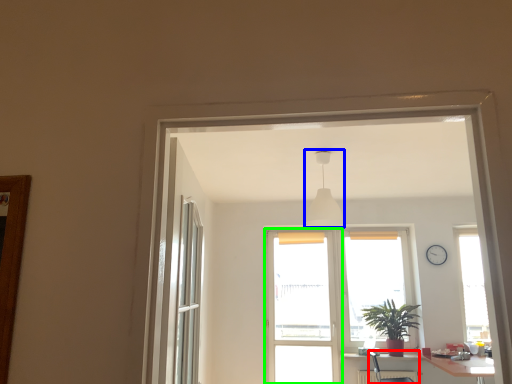
Question: Which object is positioned closest to armchair (highlighted by a red box)? Select from light fixture (highlighted by a blue box) and screen door (highlighted by a green box).

Choices:
 (A) light fixture
 (B) screen door

Answer: (B)